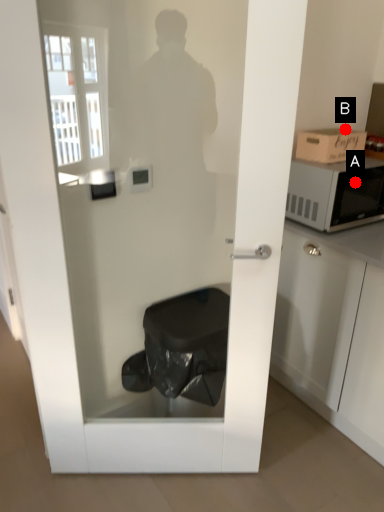
Question: Two points are circled on the image, labeled by A and B beside each circle. Among these points, which one is nearest to the camera?

Choices:
 (A) A is closer
 (B) B is closer

Answer: (A)